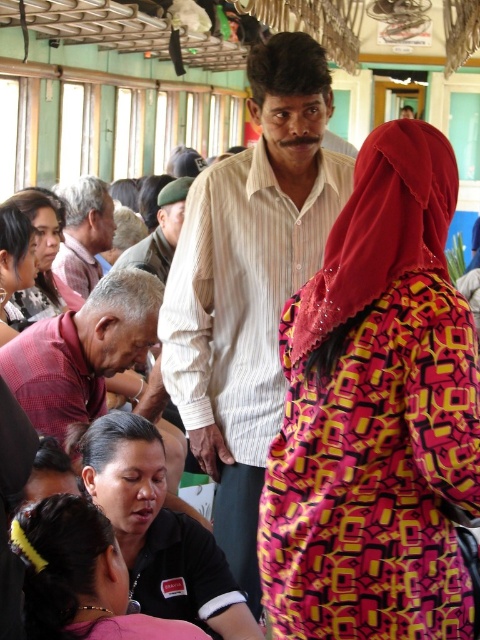
Question: Can you confirm if pink fabric at lower left is smaller than light brown striped shirt at left?

Choices:
 (A) no
 (B) yes

Answer: (B)

Question: Which point is closer to the camera taking this photo?

Choices:
 (A) (231, 540)
 (B) (76, 260)
 (C) (408, 403)

Answer: (C)

Question: Is black matte shirt at lower left closer to the viewer compared to pink fabric at lower left?

Choices:
 (A) no
 (B) yes

Answer: (A)

Question: Considering the relative positions of black matte shirt at lower left and pink fabric at lower left in the image provided, where is black matte shirt at lower left located with respect to pink fabric at lower left?

Choices:
 (A) right
 (B) left

Answer: (A)

Question: Which object is farther from the camera taking this photo?

Choices:
 (A) khaki fabric uniform at center
 (B) black matte shirt at lower left
 (C) printed fabric dress at center

Answer: (A)

Question: Among these points, which one is farthest from the camera?

Choices:
 (A) (56, 579)
 (B) (11, 221)
 (C) (84, 333)

Answer: (B)